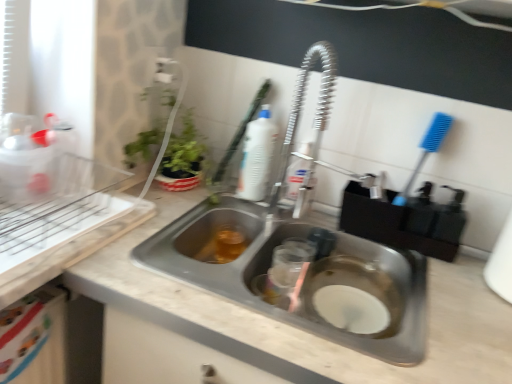
Question: Which direction should I rotate to look at white plastic bottle at upper center, which is the 1th cleaning product in left-to-right order, — up or down?

Choices:
 (A) up
 (B) down

Answer: (A)

Question: Considering the relative sizes of translucent plastic bottle at center, marked as the 1th cleaning product in a right-to-left arrangement, and metallic stainless steel sink at center in the image provided, is translucent plastic bottle at center, marked as the 1th cleaning product in a right-to-left arrangement, taller than metallic stainless steel sink at center?

Choices:
 (A) no
 (B) yes

Answer: (B)

Question: From the image's perspective, is translucent plastic bottle at center, marked as the 1th cleaning product in a right-to-left arrangement, over metallic stainless steel sink at center?

Choices:
 (A) no
 (B) yes

Answer: (B)

Question: Does translucent plastic bottle at center, positioned as the 2th cleaning product in left-to-right order, have a lesser height compared to metallic stainless steel sink at center?

Choices:
 (A) yes
 (B) no

Answer: (B)

Question: Does translucent plastic bottle at center, marked as the 1th cleaning product in a right-to-left arrangement, have a larger size compared to metallic stainless steel sink at center?

Choices:
 (A) no
 (B) yes

Answer: (A)

Question: From the image's perspective, is translucent plastic bottle at center, positioned as the 2th cleaning product in left-to-right order, located beneath metallic stainless steel sink at center?

Choices:
 (A) no
 (B) yes

Answer: (A)

Question: Considering the relative positions of translucent plastic bottle at center, marked as the 1th cleaning product in a right-to-left arrangement, and metallic stainless steel sink at center in the image provided, is translucent plastic bottle at center, marked as the 1th cleaning product in a right-to-left arrangement, behind metallic stainless steel sink at center?

Choices:
 (A) yes
 (B) no

Answer: (A)

Question: Can you confirm if translucent plastic bottle at center, marked as the 1th cleaning product in a right-to-left arrangement, is positioned to the right of white plastic brush at upper center?

Choices:
 (A) no
 (B) yes

Answer: (B)

Question: Is translucent plastic bottle at center, marked as the 1th cleaning product in a right-to-left arrangement, facing towards white plastic brush at upper center?

Choices:
 (A) yes
 (B) no

Answer: (B)

Question: Is translucent plastic bottle at center, positioned as the 2th cleaning product in left-to-right order, facing away from white plastic brush at upper center?

Choices:
 (A) yes
 (B) no

Answer: (B)

Question: From the image's perspective, does translucent plastic bottle at center, marked as the 1th cleaning product in a right-to-left arrangement, appear lower than white plastic brush at upper center?

Choices:
 (A) no
 (B) yes

Answer: (B)

Question: Considering the relative sizes of translucent plastic bottle at center, marked as the 1th cleaning product in a right-to-left arrangement, and white plastic brush at upper center in the image provided, is translucent plastic bottle at center, marked as the 1th cleaning product in a right-to-left arrangement, wider than white plastic brush at upper center?

Choices:
 (A) no
 (B) yes

Answer: (A)

Question: Are translucent plastic bottle at center, marked as the 1th cleaning product in a right-to-left arrangement, and white plastic brush at upper center making contact?

Choices:
 (A) no
 (B) yes

Answer: (A)

Question: From a real-world perspective, is translucent amber liquid at sink left physically above metallic stainless steel sink at center?

Choices:
 (A) no
 (B) yes

Answer: (B)